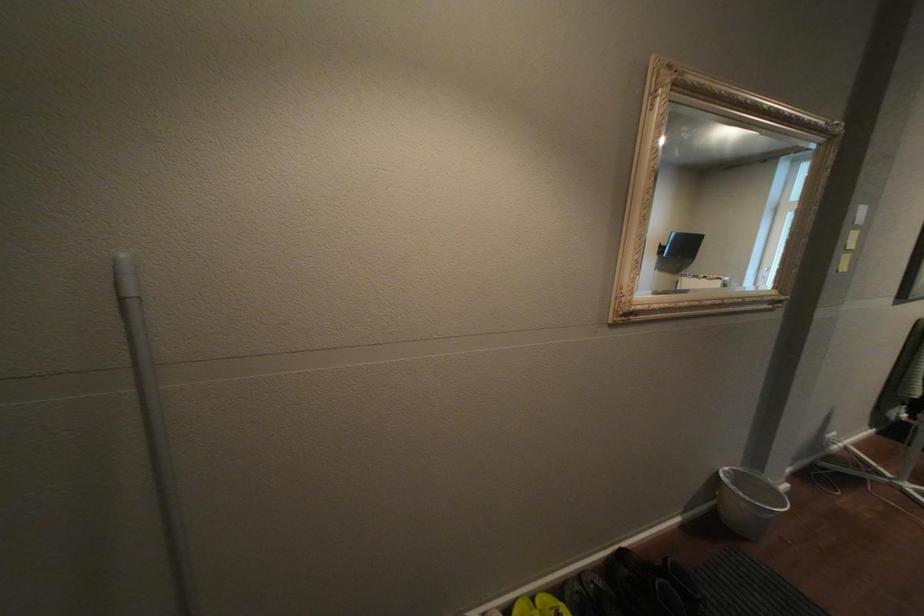
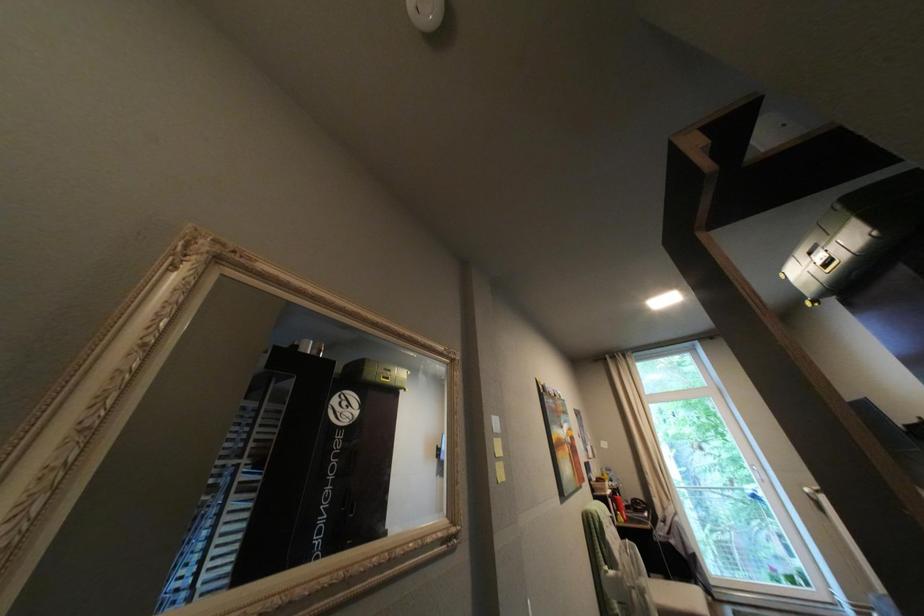
Based on the continuous images, in which direction is the camera rotating?

The camera rotated toward right-up.